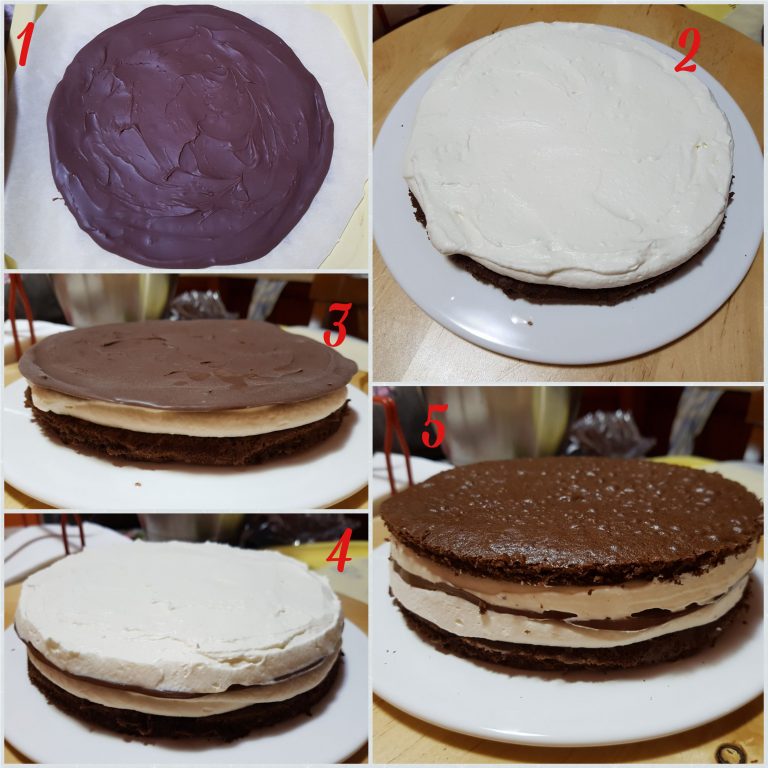
The height and width of the screenshot is (768, 768). I want to click on table, so click(x=392, y=736), click(x=310, y=558), click(x=418, y=339), click(x=11, y=501).